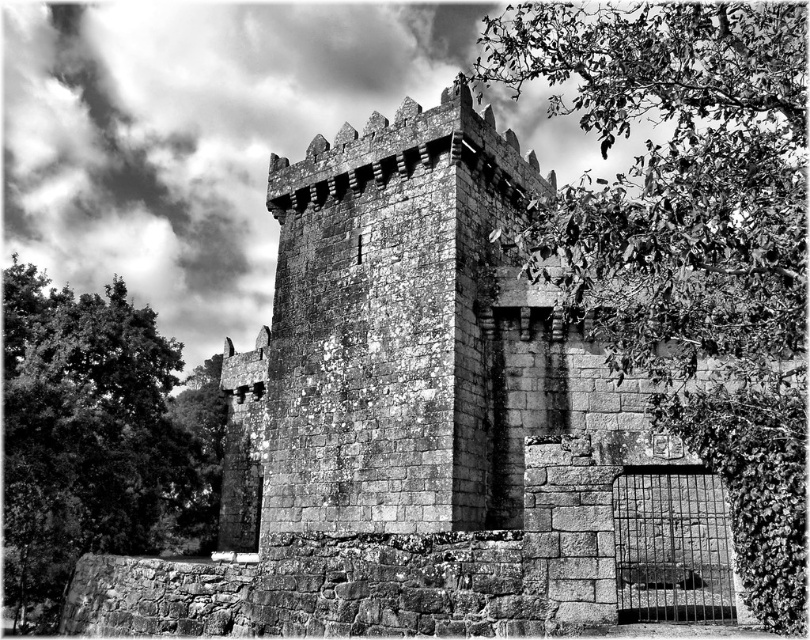
Question: Which object is closer to the camera taking this photo?

Choices:
 (A) green leafy tree at upper right
 (B) green leafy tree at left

Answer: (A)

Question: Is green leafy tree at upper right closer to the viewer compared to green leafy tree at left?

Choices:
 (A) no
 (B) yes

Answer: (B)

Question: Can you confirm if green leafy tree at upper right is positioned to the right of green leafy tree at left?

Choices:
 (A) no
 (B) yes

Answer: (B)

Question: Can you confirm if green leafy tree at upper right is positioned to the left of green leafy tree at left?

Choices:
 (A) no
 (B) yes

Answer: (A)

Question: Which point is closer to the camera?

Choices:
 (A) green leafy tree at upper right
 (B) green leafy tree at left

Answer: (A)

Question: Which point appears farthest from the camera in this image?

Choices:
 (A) (11, 388)
 (B) (800, 134)

Answer: (A)